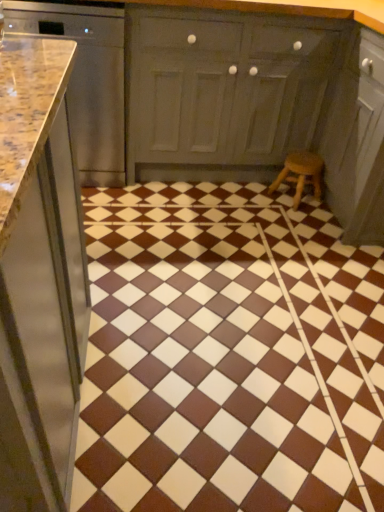
Identify the location of polished granite countertop at left, arranged as the 2th cabinetry when viewed from the right. This screenshot has width=384, height=512. (86, 80).

What do you see at coordinates (301, 174) in the screenshot? The image size is (384, 512). I see `wooden stool at lower right` at bounding box center [301, 174].

Identify the location of polished granite countertop at left, acting as the first cabinetry starting from the left. (86, 80).

From the image's perspective, which one is positioned lower, wooden stool at lower right or matte gray cabinet at center, placed as the second cabinetry when sorted from left to right?

wooden stool at lower right appears lower in the image.

Considering the positions of objects wooden stool at lower right and matte gray cabinet at center, placed as the second cabinetry when sorted from left to right, in the image provided, who is more to the left, wooden stool at lower right or matte gray cabinet at center, placed as the second cabinetry when sorted from left to right,?

From the viewer's perspective, matte gray cabinet at center, placed as the second cabinetry when sorted from left to right, appears more on the left side.

Considering the sizes of wooden stool at lower right and matte gray cabinet at center, placed as the second cabinetry when sorted from left to right, in the image, is wooden stool at lower right wider or thinner than matte gray cabinet at center, placed as the second cabinetry when sorted from left to right,?

Clearly, wooden stool at lower right has less width compared to matte gray cabinet at center, placed as the second cabinetry when sorted from left to right.

Which is behind, point (277, 186) or point (236, 170)?

The point (236, 170) is farther from the camera.

Could you tell me if matte gray cabinet at center, placed as the second cabinetry when sorted from left to right, is turned towards brown glossy tile at center?

Yes, matte gray cabinet at center, placed as the second cabinetry when sorted from left to right, is facing brown glossy tile at center.

Looking at this image, who is shorter, matte gray cabinet at center, placed as the second cabinetry when sorted from left to right, or brown glossy tile at center?

brown glossy tile at center.

From the image's perspective, would you say matte gray cabinet at center, placed as the second cabinetry when sorted from left to right, is positioned over brown glossy tile at center?

Yes, from the image's perspective, matte gray cabinet at center, placed as the second cabinetry when sorted from left to right, is over brown glossy tile at center.

In the scene shown: From a real-world perspective, is brown glossy tile at center located higher than polished granite countertop at left, acting as the first cabinetry starting from the left?

No, from a real-world perspective, brown glossy tile at center is not over polished granite countertop at left, acting as the first cabinetry starting from the left

Who is more distant, brown glossy tile at center or polished granite countertop at left, arranged as the 2th cabinetry when viewed from the right?

polished granite countertop at left, arranged as the 2th cabinetry when viewed from the right, is behind.

Are brown glossy tile at center and polished granite countertop at left, acting as the first cabinetry starting from the left, beside each other?

brown glossy tile at center and polished granite countertop at left, acting as the first cabinetry starting from the left, are not in contact.

Does brown glossy tile at center have a larger size compared to polished granite countertop at left, acting as the first cabinetry starting from the left?

Yes.

In the scene shown: Are polished granite countertop at left, arranged as the 2th cabinetry when viewed from the right, and matte gray cabinet at center, marked as the first cabinetry in a right-to-left arrangement, far apart?

polished granite countertop at left, arranged as the 2th cabinetry when viewed from the right, is actually quite close to matte gray cabinet at center, marked as the first cabinetry in a right-to-left arrangement.

From the picture: Is polished granite countertop at left, acting as the first cabinetry starting from the left, situated inside matte gray cabinet at center, placed as the second cabinetry when sorted from left to right, or outside?

polished granite countertop at left, acting as the first cabinetry starting from the left, lies outside matte gray cabinet at center, placed as the second cabinetry when sorted from left to right.

From the image's perspective, between polished granite countertop at left, arranged as the 2th cabinetry when viewed from the right, and matte gray cabinet at center, placed as the second cabinetry when sorted from left to right, which one is located above?

matte gray cabinet at center, placed as the second cabinetry when sorted from left to right, appears higher in the image.

Which of these two, polished granite countertop at left, acting as the first cabinetry starting from the left, or matte gray cabinet at center, marked as the first cabinetry in a right-to-left arrangement, is bigger?

matte gray cabinet at center, marked as the first cabinetry in a right-to-left arrangement.

In order to click on the 2nd cabinetry above when counting from the brown glossy tile at center (from the image's perspective) in this screenshot , I will do `click(225, 91)`.

From the image's perspective, which one is positioned lower, brown glossy tile at center or matte gray cabinet at center, marked as the first cabinetry in a right-to-left arrangement?

brown glossy tile at center appears lower in the image.

Can matte gray cabinet at center, marked as the first cabinetry in a right-to-left arrangement, be found inside brown glossy tile at center?

No, matte gray cabinet at center, marked as the first cabinetry in a right-to-left arrangement, is not a part of brown glossy tile at center.

Locate an element on the screen. The image size is (384, 512). stool to the right of brown glossy tile at center is located at coordinates (301, 174).

From a real-world perspective, who is located lower, brown glossy tile at center or wooden stool at lower right?

brown glossy tile at center, from a real-world perspective.

Does brown glossy tile at center lie behind wooden stool at lower right?

No, brown glossy tile at center is in front of wooden stool at lower right.

Considering the positions of objects brown glossy tile at center and wooden stool at lower right in the image provided, who is more to the right, brown glossy tile at center or wooden stool at lower right?

wooden stool at lower right is more to the right.

Is wooden stool at lower right oriented towards polished granite countertop at left, arranged as the 2th cabinetry when viewed from the right?

No, wooden stool at lower right does not turn towards polished granite countertop at left, arranged as the 2th cabinetry when viewed from the right.

Does wooden stool at lower right come in front of polished granite countertop at left, arranged as the 2th cabinetry when viewed from the right?

No.

Is point (315, 184) positioned after point (77, 105)?

Yes, point (315, 184) is farther from viewer.

From the image's perspective, which one is positioned lower, wooden stool at lower right or polished granite countertop at left, acting as the first cabinetry starting from the left?

wooden stool at lower right.

From a real-world perspective, count 2nd cabinetrys upward from the wooden stool at lower right and point to it. Please provide its 2D coordinates.

[(225, 91)]

Identify the location of the 1st cabinetry counting from the left of the brown glossy tile at center. Image resolution: width=384 pixels, height=512 pixels. (225, 91).

When comparing their distances from wooden stool at lower right, does brown glossy tile at center or matte gray cabinet at center, placed as the second cabinetry when sorted from left to right, seem closer?

matte gray cabinet at center, placed as the second cabinetry when sorted from left to right, lies closer to wooden stool at lower right than the other object.

Based on their spatial positions, is brown glossy tile at center or matte gray cabinet at center, marked as the first cabinetry in a right-to-left arrangement, closer to polished granite countertop at left, acting as the first cabinetry starting from the left?

matte gray cabinet at center, marked as the first cabinetry in a right-to-left arrangement, lies closer to polished granite countertop at left, acting as the first cabinetry starting from the left, than the other object.

Which object lies further to the anchor point brown glossy tile at center, wooden stool at lower right or polished granite countertop at left, arranged as the 2th cabinetry when viewed from the right?

The object further to brown glossy tile at center is polished granite countertop at left, arranged as the 2th cabinetry when viewed from the right.

From the image, which object appears to be farther from polished granite countertop at left, arranged as the 2th cabinetry when viewed from the right, matte gray cabinet at center, placed as the second cabinetry when sorted from left to right, or brown glossy tile at center?

brown glossy tile at center lies further to polished granite countertop at left, arranged as the 2th cabinetry when viewed from the right, than the other object.

Estimate the real-world distances between objects in this image. Which object is further from wooden stool at lower right, brown glossy tile at center or polished granite countertop at left, arranged as the 2th cabinetry when viewed from the right?

Among the two, polished granite countertop at left, arranged as the 2th cabinetry when viewed from the right, is located further to wooden stool at lower right.

Considering their positions, is polished granite countertop at left, arranged as the 2th cabinetry when viewed from the right, positioned closer to brown glossy tile at center than wooden stool at lower right?

The object closer to brown glossy tile at center is wooden stool at lower right.

From the image, which object appears to be farther from matte gray cabinet at center, marked as the first cabinetry in a right-to-left arrangement, brown glossy tile at center or polished granite countertop at left, acting as the first cabinetry starting from the left?

The object further to matte gray cabinet at center, marked as the first cabinetry in a right-to-left arrangement, is brown glossy tile at center.

From the image, which object appears to be nearer to matte gray cabinet at center, placed as the second cabinetry when sorted from left to right, polished granite countertop at left, arranged as the 2th cabinetry when viewed from the right, or wooden stool at lower right?

polished granite countertop at left, arranged as the 2th cabinetry when viewed from the right.

This screenshot has height=512, width=384. In order to click on cabinetry between polished granite countertop at left, acting as the first cabinetry starting from the left, and wooden stool at lower right, in the horizontal direction in this screenshot , I will do `click(225, 91)`.

The width and height of the screenshot is (384, 512). What are the coordinates of `ceramic tile between polished granite countertop at left, arranged as the 2th cabinetry when viewed from the right, and wooden stool at lower right, in the horizontal direction` in the screenshot? It's located at (228, 355).

I want to click on cabinetry that lies between matte gray cabinet at center, marked as the first cabinetry in a right-to-left arrangement, and brown glossy tile at center from top to bottom, so click(86, 80).